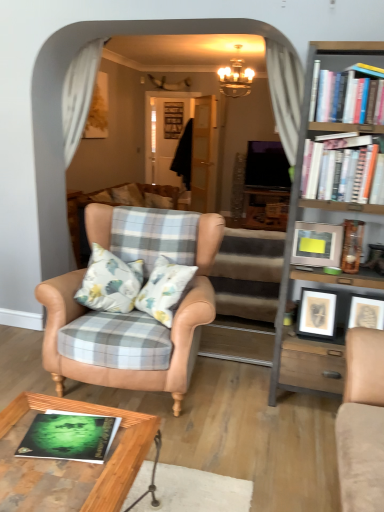
Question: Which direction should I rotate to look at white glossy door at center, marked as the first glass door in a front-to-back arrangement, — up or down?

Choices:
 (A) down
 (B) up

Answer: (B)

Question: Can you confirm if gold metallic chandelier at upper center is thinner than metallic silver picture frame at right, which ranks as the 1th picture frame in top-to-bottom order?

Choices:
 (A) yes
 (B) no

Answer: (B)

Question: Is metallic silver picture frame at right, placed as the 2th picture frame when sorted from bottom to top, inside gold metallic chandelier at upper center?

Choices:
 (A) no
 (B) yes

Answer: (A)

Question: Considering the relative sizes of gold metallic chandelier at upper center and metallic silver picture frame at right, which ranks as the 1th picture frame in top-to-bottom order, in the image provided, is gold metallic chandelier at upper center bigger than metallic silver picture frame at right, which ranks as the 1th picture frame in top-to-bottom order,?

Choices:
 (A) yes
 (B) no

Answer: (A)

Question: Are gold metallic chandelier at upper center and metallic silver picture frame at right, which ranks as the 1th picture frame in top-to-bottom order, located far from each other?

Choices:
 (A) yes
 (B) no

Answer: (A)

Question: Is metallic silver picture frame at right, placed as the 2th picture frame when sorted from bottom to top, at the back of gold metallic chandelier at upper center?

Choices:
 (A) yes
 (B) no

Answer: (B)

Question: Could you tell me if gold metallic chandelier at upper center is facing metallic silver picture frame at right, which ranks as the 1th picture frame in top-to-bottom order?

Choices:
 (A) yes
 (B) no

Answer: (A)

Question: From the image's perspective, would you say white paperbacks at upper right, arranged as the 2th book when viewed from the front, is positioned over metallic silver picture frame at right, which ranks as the 1th picture frame in top-to-bottom order?

Choices:
 (A) yes
 (B) no

Answer: (A)

Question: Is white paperbacks at upper right, which is counted as the first book, starting from the top, thinner than metallic silver picture frame at right, placed as the 2th picture frame when sorted from bottom to top?

Choices:
 (A) no
 (B) yes

Answer: (A)

Question: From the image's perspective, is white paperbacks at upper right, arranged as the 2th book when viewed from the front, under metallic silver picture frame at right, which ranks as the 1th picture frame in top-to-bottom order?

Choices:
 (A) no
 (B) yes

Answer: (A)

Question: Considering the relative positions of white paperbacks at upper right, which is counted as the first book, starting from the top, and metallic silver picture frame at right, which ranks as the 1th picture frame in top-to-bottom order, in the image provided, is white paperbacks at upper right, which is counted as the first book, starting from the top, to the right of metallic silver picture frame at right, which ranks as the 1th picture frame in top-to-bottom order, from the viewer's perspective?

Choices:
 (A) no
 (B) yes

Answer: (B)

Question: Can you confirm if white paperbacks at upper right, which is the 2th book in bottom-to-top order, is shorter than metallic silver picture frame at right, which ranks as the 1th picture frame in top-to-bottom order?

Choices:
 (A) no
 (B) yes

Answer: (A)

Question: Is white paperbacks at upper right, which is counted as the first book, starting from the top, oriented away from metallic silver picture frame at right, which ranks as the 1th picture frame in top-to-bottom order?

Choices:
 (A) yes
 (B) no

Answer: (B)

Question: From a real-world perspective, is woodenwoodentable at lower center below green matte book at lower left, the first book positioned from the left?

Choices:
 (A) yes
 (B) no

Answer: (A)